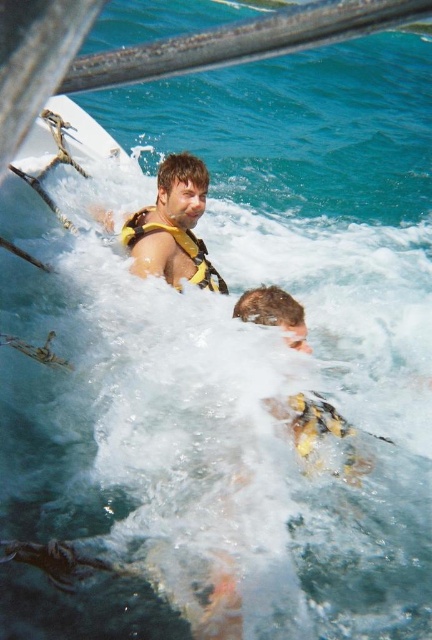
Can you confirm if yellow life vest at upper center is smaller than yellow/yellowish fabric life jacket at upper center?

No, yellow life vest at upper center is not smaller than yellow/yellowish fabric life jacket at upper center.

Is point (191, 186) positioned after point (206, 275)?

No, (191, 186) is in front of (206, 275).

Is point (178, 221) closer to camera compared to point (140, 218)?

Yes, it is in front of point (140, 218).

Locate an element on the screen. This screenshot has height=640, width=432. yellow life vest at upper center is located at coordinates (172, 227).